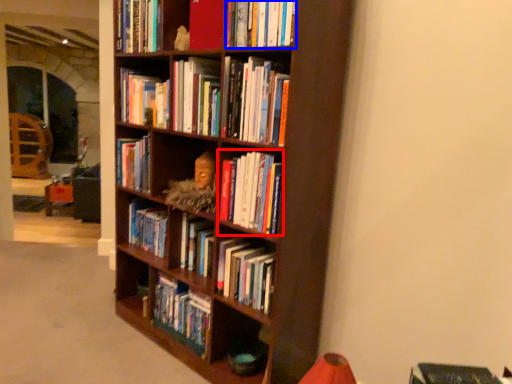
Question: Which object appears closest to the camera in this image, book (highlighted by a red box) or book (highlighted by a blue box)?

Choices:
 (A) book
 (B) book

Answer: (B)